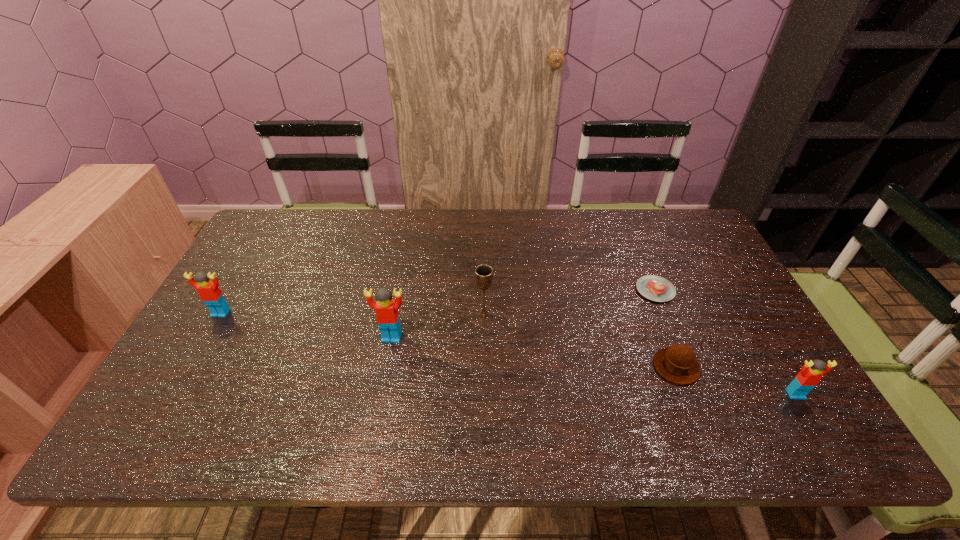
Where is `empty space between the shortest object and the muffin`? The width and height of the screenshot is (960, 540). empty space between the shortest object and the muffin is located at coordinates (665, 328).

At what (x,y) coordinates should I click in order to perform the action: click on free space between the chalice and the leftmost Lego. Please return your answer as a coordinate pair (x, y). Looking at the image, I should click on (352, 314).

Find the location of a particular element. Image resolution: width=960 pixels, height=540 pixels. vacant area that lies between the second nearest Lego and the farthest Lego is located at coordinates (306, 325).

The image size is (960, 540). I want to click on empty location between the fourth object from right to left and the second shortest Lego, so 352,314.

This screenshot has width=960, height=540. I want to click on free spot between the third object from left to right and the second object from left to right, so click(x=438, y=326).

Find the location of a particular element. empty location between the second nearest Lego and the rightmost object is located at coordinates (593, 366).

Identify which object is the fourth closest to the leftmost object. Please provide its 2D coordinates. Your answer should be formatted as a tuple, i.e. [(x, y)], where the tuple contains the x and y coordinates of a point satisfying the conditions above.

[(656, 288)]

You are a GUI agent. You are given a task and a screenshot of the screen. Output one action in this format:
    pyautogui.click(x=<x>, y=<y>)
    Task: Click on the object that is the fourth closest one to the fourth farthest object
    The width and height of the screenshot is (960, 540).
    Given the screenshot: What is the action you would take?
    pyautogui.click(x=656, y=288)

Select which Lego is the third closest to the fifth tallest object. Please provide its 2D coordinates. Your answer should be formatted as a tuple, i.e. [(x, y)], where the tuple contains the x and y coordinates of a point satisfying the conditions above.

[(209, 292)]

Find the location of a particular element. The image size is (960, 540). the second closest Lego to the second shortest Lego is located at coordinates (811, 373).